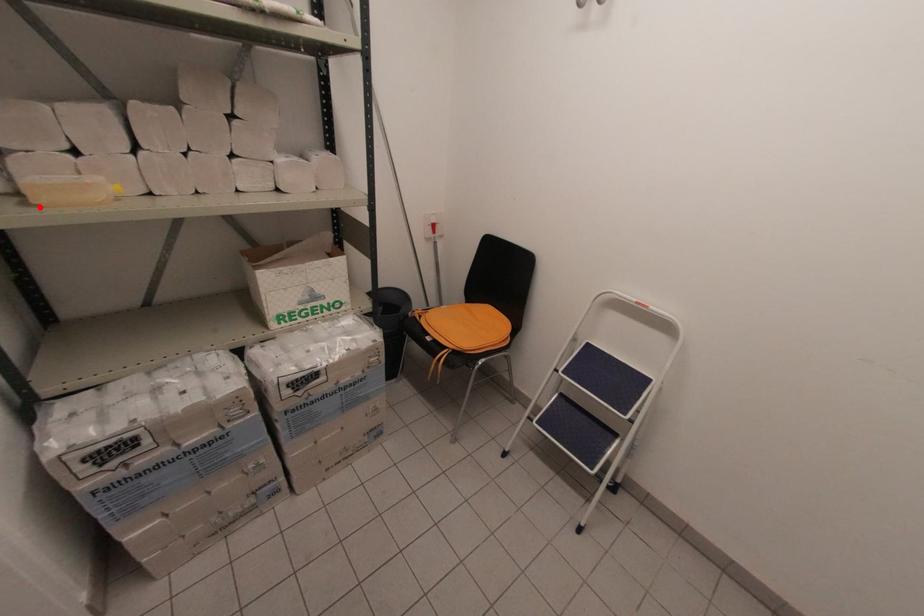
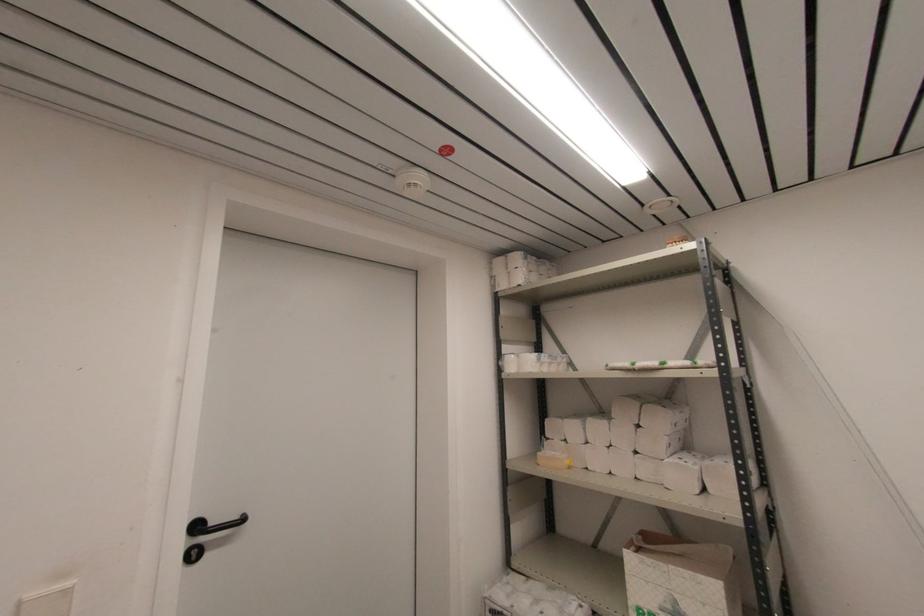
In the second image, find the point that corresponds to the highlighted location in the first image.

(540, 464)